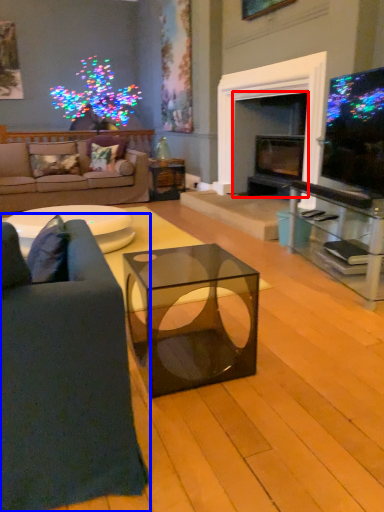
Question: Which object is closer to the camera taking this photo, fireplace (highlighted by a red box) or studio couch (highlighted by a blue box)?

Choices:
 (A) fireplace
 (B) studio couch

Answer: (B)